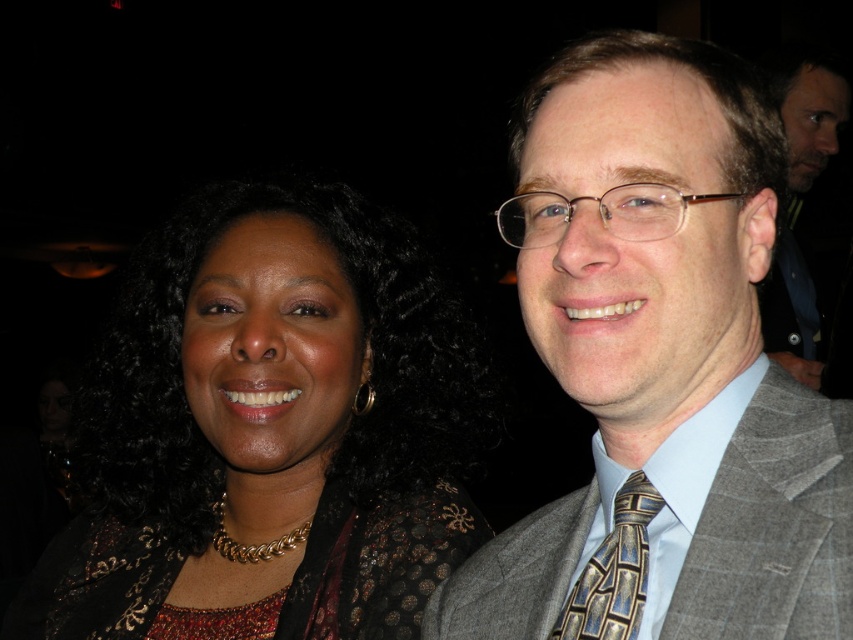
Does gold beaded necklace at center have a lesser width compared to gold-patterned tie at right?

No, gold beaded necklace at center is not thinner than gold-patterned tie at right.

What do you see at coordinates (270, 429) in the screenshot? Image resolution: width=853 pixels, height=640 pixels. I see `gold beaded necklace at center` at bounding box center [270, 429].

Locate an element on the screen. This screenshot has width=853, height=640. gold beaded necklace at center is located at coordinates (270, 429).

Can you confirm if gray textured suit at center is taller than gold-patterned tie at right?

Correct, gray textured suit at center is much taller as gold-patterned tie at right.

Is point (479, 625) positioned after point (587, 595)?

Yes.

Does point (701, 224) lie behind point (631, 540)?

No, it is in front of (631, 540).

Identify the location of gray textured suit at center. (662, 368).

Based on the photo, is gold beaded necklace at center further to the viewer compared to gray wool suit at right?

Yes, it is behind gray wool suit at right.

Which is below, gold beaded necklace at center or gray wool suit at right?

gold beaded necklace at center is lower down.

Between point (419, 472) and point (734, 468), which one is positioned behind?

Positioned behind is point (419, 472).

This screenshot has width=853, height=640. I want to click on gold beaded necklace at center, so click(270, 429).